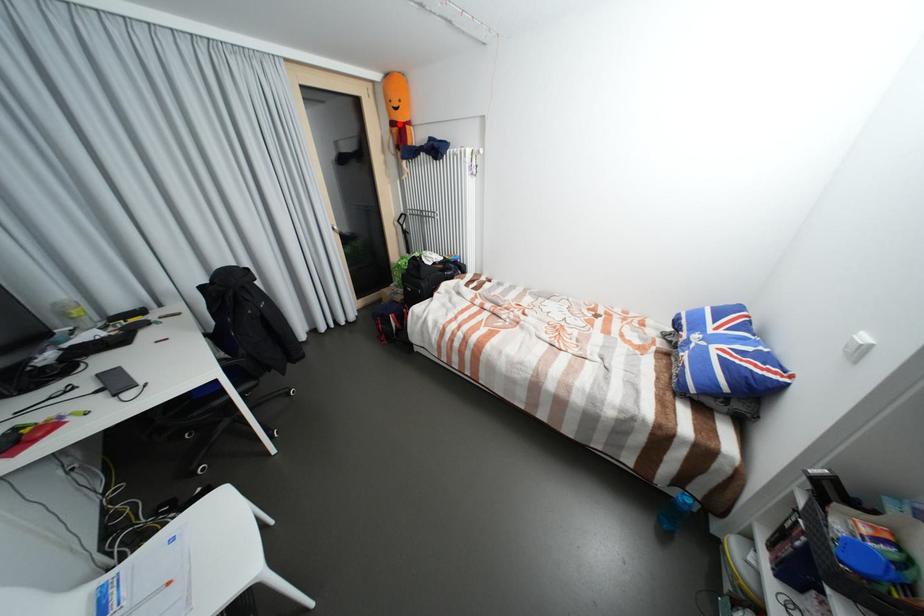
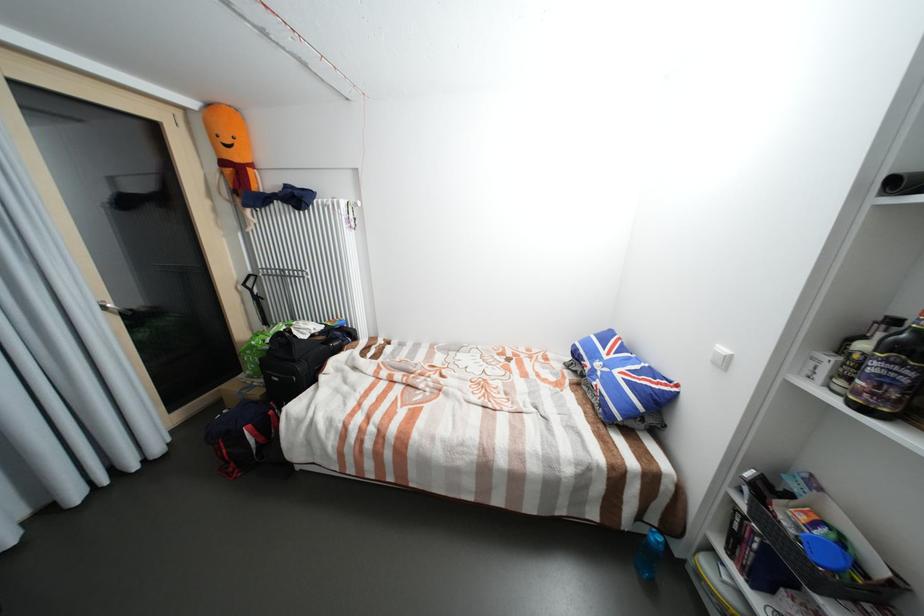
The point at the highlighted location is marked in the first image. Where is the corresponding point in the second image?

(229, 163)